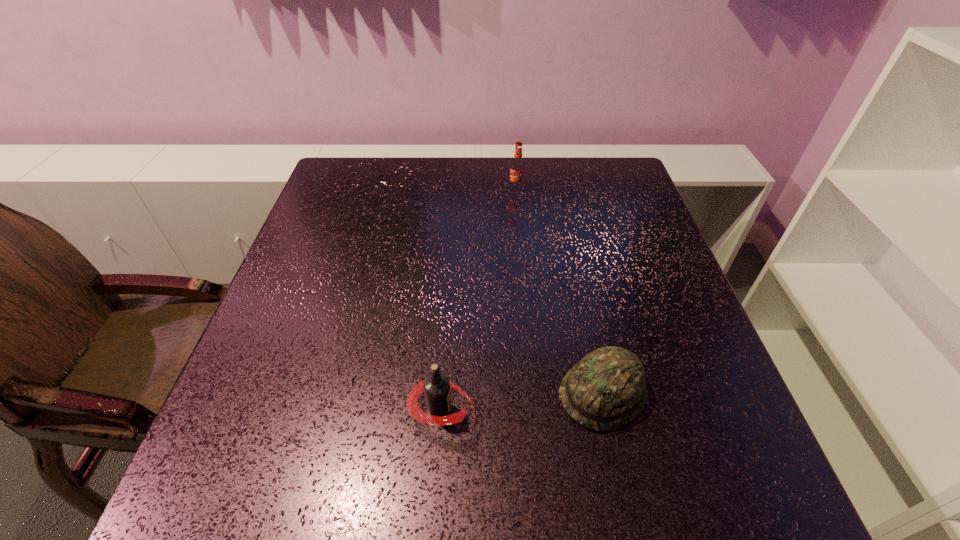
You are a GUI agent. You are given a task and a screenshot of the screen. Output one action in this format:
    pyautogui.click(x=<x>, y=<y>)
    Task: Click on the free area in between the left root beer and the right root beer
    
    Given the screenshot: What is the action you would take?
    pyautogui.click(x=478, y=299)

The width and height of the screenshot is (960, 540). I want to click on free space between the shortest object and the nearer root beer, so click(522, 401).

The width and height of the screenshot is (960, 540). What are the coordinates of `vacant area that lies between the second object from right to left and the left root beer` in the screenshot? It's located at (478, 299).

Identify the location of empty location between the headwear and the farthest object. The width and height of the screenshot is (960, 540). (560, 290).

Where is `empty location between the left root beer and the shortest object`? Image resolution: width=960 pixels, height=540 pixels. empty location between the left root beer and the shortest object is located at coordinates (522, 401).

You are a GUI agent. You are given a task and a screenshot of the screen. Output one action in this format:
    pyautogui.click(x=<x>, y=<y>)
    Task: Click on the free spot between the shortest object and the leftmost object
    The image size is (960, 540).
    Given the screenshot: What is the action you would take?
    pyautogui.click(x=522, y=401)

Locate an element on the screen. Image resolution: width=960 pixels, height=540 pixels. free point between the farther root beer and the shortest object is located at coordinates (560, 290).

Locate an element on the screen. vacant area that lies between the leftmost object and the farthest object is located at coordinates (478, 299).

At what (x,y) coordinates should I click in order to perform the action: click on object that is the closest to the leftmost object. Please return your answer as a coordinate pair (x, y). Looking at the image, I should click on (605, 390).

The image size is (960, 540). I want to click on the closest object to the shortest object, so click(x=436, y=386).